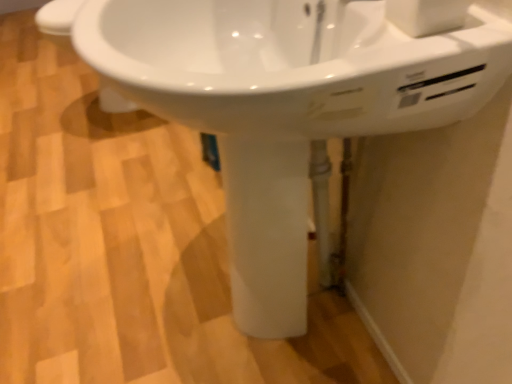
This screenshot has width=512, height=384. I want to click on free spot to the left of white glossy toilet bowl at lower left, so click(x=38, y=106).